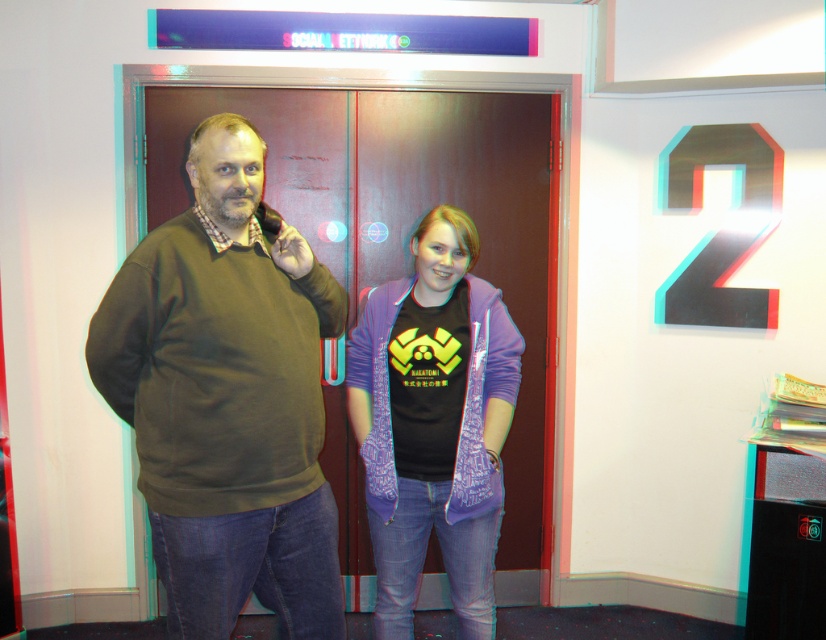
You are a photographer adjusting the camera focus. The matte green sweater at center and the purple cotton jacket at center are both in the frame. Which object is closer to the camera?

The matte green sweater at center is closer to the camera than the purple cotton jacket at center because it is only 18.30 inches away from it.

You are standing in front of the door labeled SOCIAL NETWORK. You need to determine the spatial relationship between the matte green sweater at center and the purple cotton jacket at center. Which one is positioned to the left?

The matte green sweater at center is to the left of the purple cotton jacket at center.